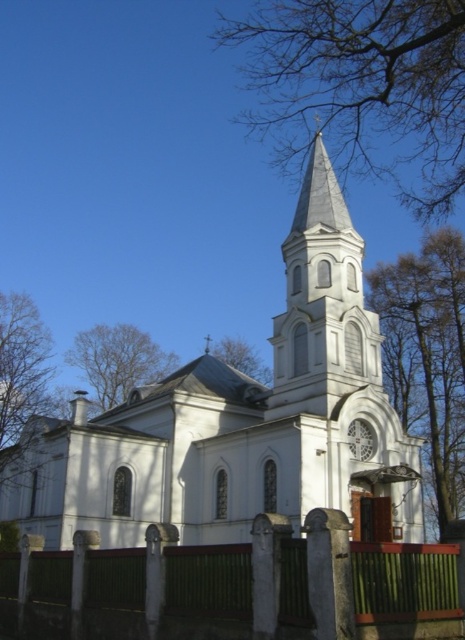
You are standing in front of the church and want to take a photo that includes both the green leafy tree at right and the brown wood tree at left. Which tree should you position closer to the camera to ensure both are visible in the frame?

To include both the green leafy tree at right and the brown wood tree at left in the photo, position the green leafy tree at right closer to the camera since the brown wood tree at left is behind it, ensuring both are visible in the frame.

You are standing at the center of the image and looking towards the white church with a prominent steeple. Which direction should you turn to see the brown wood tree at left?

The brown wood tree at left is located at point coordinates of 0.600 on the x axis and 0.049 on the y axis. Since the x coordinate is greater than 0.5, it means the brown wood tree at left is to your right side. Therefore, you should turn to your right to see the brown wood tree at left.

You are standing in front of the church and notice two points marked on the steeple. The first point is at coordinates point (19,348) and the second is at point (100,404). Which point is closer to you?

Point (19,348) is closer to you because it is further to the viewer than point (100,404).